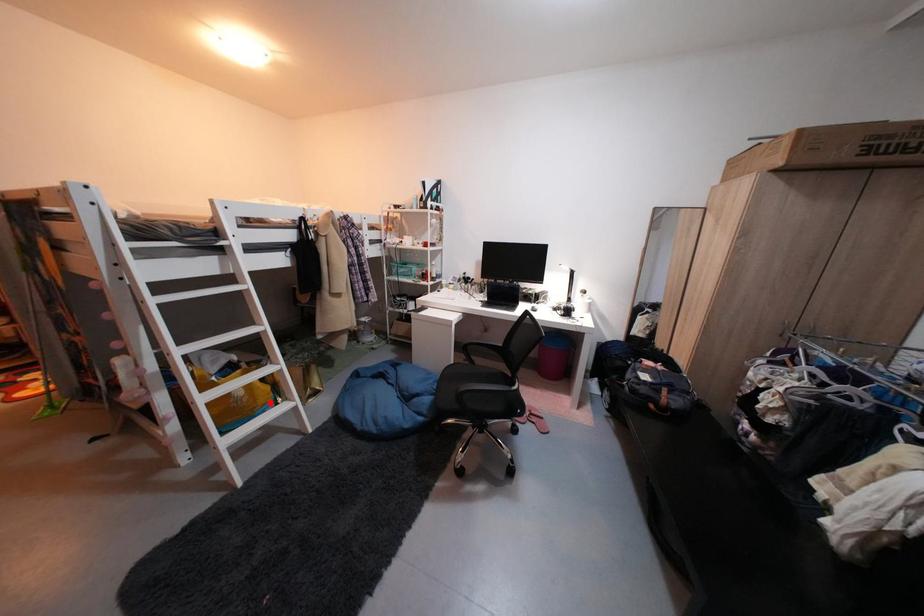
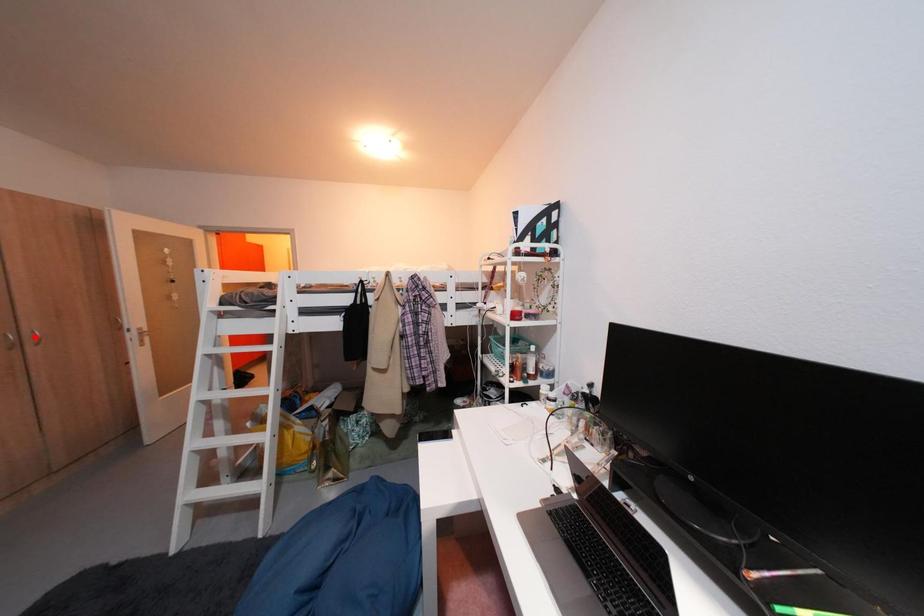
I am providing you with two images of the same scene from different viewpoints. A red point is marked on the first image and another point is marked on the second image. Are the points marked in image1 and image2 representing the same 3D position?

No